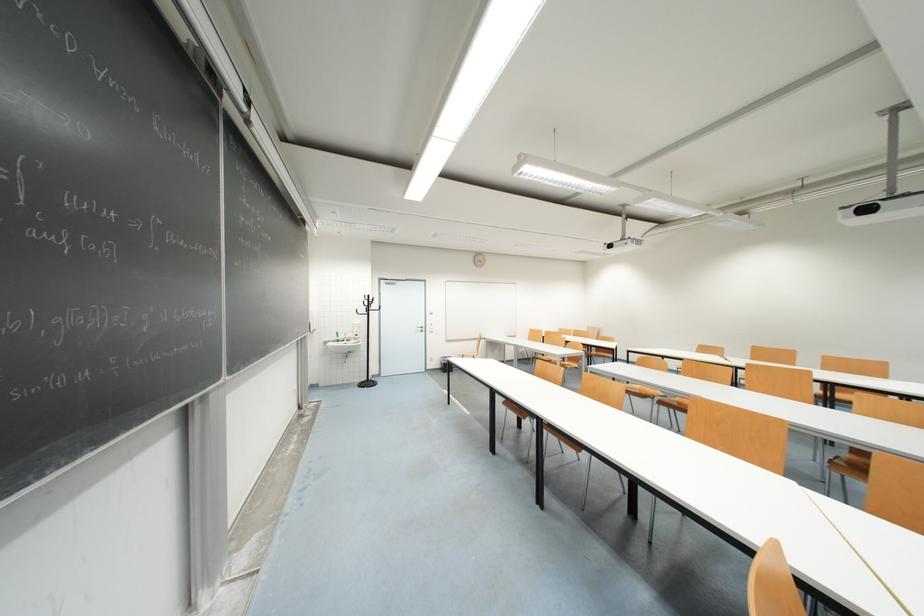
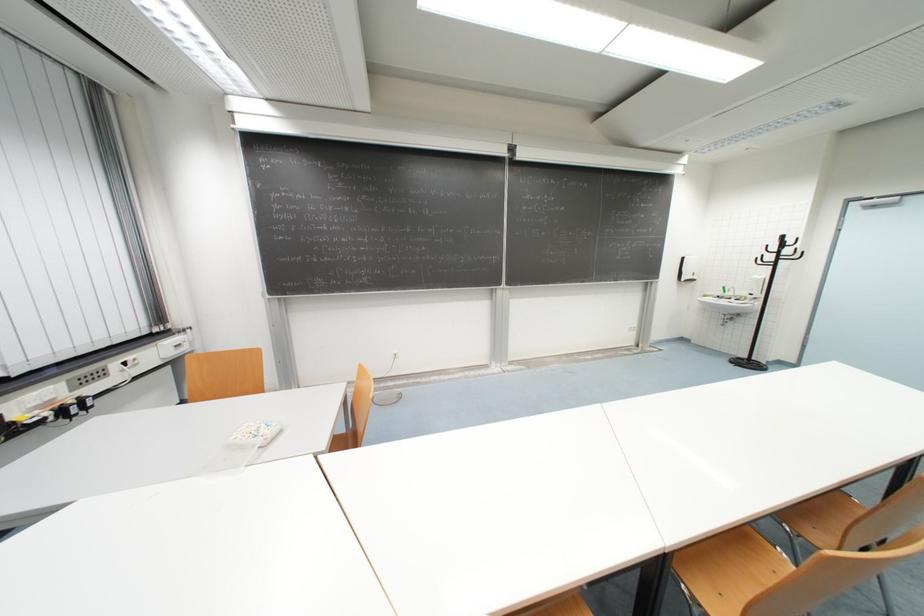
Find the pixel in the second image that matches [371,306] in the first image.

(779, 251)